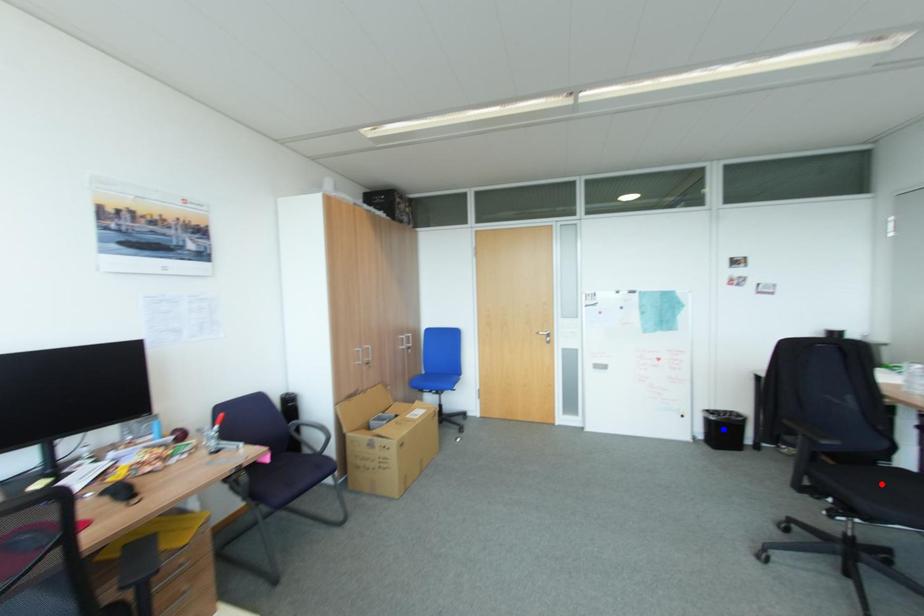
Question: Two points are marked on the image. Which point is closer to the camera?

Choices:
 (A) Blue point is closer.
 (B) Red point is closer.

Answer: (B)